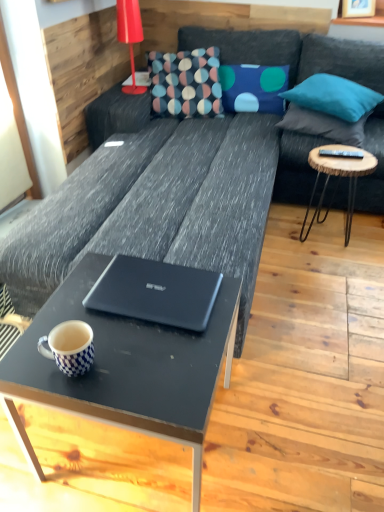
What are the coordinates of `blue fabric pillow at upper right, the first pillow positioned from the left` in the screenshot? It's located at (253, 88).

Describe the element at coordinates (156, 292) in the screenshot. I see `matte black laptop at center` at that location.

This screenshot has width=384, height=512. I want to click on matte red lamp at upper left, so click(x=130, y=36).

This screenshot has height=512, width=384. What are the coordinates of `black plastic remote at right` in the screenshot? It's located at (341, 153).

Image resolution: width=384 pixels, height=512 pixels. Describe the element at coordinates (164, 200) in the screenshot. I see `dark gray fabric couch at center` at that location.

You are a GUI agent. You are given a task and a screenshot of the screen. Output one action in this format:
    pyautogui.click(x=<x>, y=<y>)
    Task: Click on the blue fabric pillow at upper right, the first pillow positioned from the left
    Image resolution: width=384 pixels, height=512 pixels.
    Given the screenshot: What is the action you would take?
    pyautogui.click(x=253, y=88)

How different are the orientations of wooden picture frame at upper right and white checkered mug at lower left in degrees?

The angular difference between wooden picture frame at upper right and white checkered mug at lower left is 71.1 degrees.

Between wooden picture frame at upper right and white checkered mug at lower left, which one is positioned in front?

white checkered mug at lower left is more forward.

Would you say wooden picture frame at upper right is a long distance from white checkered mug at lower left?

Yes, wooden picture frame at upper right and white checkered mug at lower left are quite far apart.

Is point (350, 2) positioned before point (64, 357)?

No, (350, 2) is behind (64, 357).

Is blue fabric pillow at upper right, the first pillow positioned from the left, smaller than dark gray fabric couch at center?

Correct, blue fabric pillow at upper right, the first pillow positioned from the left, occupies less space than dark gray fabric couch at center.

Are blue fabric pillow at upper right, the first pillow positioned from the left, and dark gray fabric couch at center located far from each other?

Actually, blue fabric pillow at upper right, the first pillow positioned from the left, and dark gray fabric couch at center are a little close together.

Based on the photo, what's the angular difference between blue fabric pillow at upper right, which is counted as the third pillow, starting from the right, and dark gray fabric couch at center's facing directions?

The angle between the facing direction of blue fabric pillow at upper right, which is counted as the third pillow, starting from the right, and the facing direction of dark gray fabric couch at center is 6.4 degrees.

Locate an element on the screen. Image resolution: width=384 pixels, height=512 pixels. studio couch that is in front of the blue fabric pillow at upper right, the first pillow positioned from the left is located at coordinates (164, 200).

Can you see teal fabric pillow at upper right, which appears as the first pillow when viewed from the right, touching teal fabric pillow at upper right, which appears as the second pillow when viewed from the left?

Yes.

Locate an element on the screen. the 2nd pillow directly beneath the teal fabric pillow at upper right, which appears as the second pillow when viewed from the left (from a real-world perspective) is located at coordinates (323, 125).

From a real-world perspective, is teal fabric pillow at upper right, positioned as the 3th pillow in left-to-right order, located higher than teal fabric pillow at upper right, which appears as the second pillow when viewed from the left?

No.

Is teal fabric pillow at upper right, positioned as the 3th pillow in left-to-right order, to the right of teal fabric pillow at upper right, which appears as the second pillow when viewed from the left, from the viewer's perspective?

Yes, teal fabric pillow at upper right, positioned as the 3th pillow in left-to-right order, is to the right of teal fabric pillow at upper right, which appears as the second pillow when viewed from the left.

How far apart are teal fabric pillow at upper right, which appears as the second pillow when viewed from the left, and black plastic remote at right?

teal fabric pillow at upper right, which appears as the second pillow when viewed from the left, and black plastic remote at right are 38.95 centimeters apart from each other.

Does teal fabric pillow at upper right, the second pillow viewed from the right, turn towards black plastic remote at right?

No.

Is teal fabric pillow at upper right, the second pillow viewed from the right, far from black plastic remote at right?

That's not correct — teal fabric pillow at upper right, the second pillow viewed from the right, is a little close to black plastic remote at right.

Who is shorter, teal fabric pillow at upper right, positioned as the 3th pillow in left-to-right order, or dark gray fabric couch at center?

teal fabric pillow at upper right, positioned as the 3th pillow in left-to-right order, is shorter.

Considering the positions of objects teal fabric pillow at upper right, positioned as the 3th pillow in left-to-right order, and dark gray fabric couch at center in the image provided, who is more to the left, teal fabric pillow at upper right, positioned as the 3th pillow in left-to-right order, or dark gray fabric couch at center?

dark gray fabric couch at center.

From the image's perspective, would you say teal fabric pillow at upper right, positioned as the 3th pillow in left-to-right order, is positioned over dark gray fabric couch at center?

Yes, from the image's perspective, teal fabric pillow at upper right, positioned as the 3th pillow in left-to-right order, is on top of dark gray fabric couch at center.

What's the angular difference between teal fabric pillow at upper right, positioned as the 3th pillow in left-to-right order, and dark gray fabric couch at center's facing directions?

There is a 81.6-degree angle between the facing directions of teal fabric pillow at upper right, positioned as the 3th pillow in left-to-right order, and dark gray fabric couch at center.

Which object is positioned more to the right, black plastic remote at right or dark gray fabric couch at center?

black plastic remote at right.

Can you see black plastic remote at right touching dark gray fabric couch at center?

black plastic remote at right and dark gray fabric couch at center are not in contact.

I want to click on remote on the right side of dark gray fabric couch at center, so click(341, 153).

Who is shorter, matte red lamp at upper left or matte black laptop at center?

With less height is matte black laptop at center.

Consider the image. Considering the positions of objects matte red lamp at upper left and matte black laptop at center in the image provided, who is more to the right, matte red lamp at upper left or matte black laptop at center?

Positioned to the right is matte black laptop at center.

Is matte red lamp at upper left in front of or behind matte black laptop at center in the image?

Visually, matte red lamp at upper left is located behind matte black laptop at center.

Is matte red lamp at upper left looking in the opposite direction of matte black laptop at center?

No, matte black laptop at center is not at the back of matte red lamp at upper left.

Find the location of `picture frame above the white checkered mug at lower left (from a real-world perspective)`. picture frame above the white checkered mug at lower left (from a real-world perspective) is located at coordinates (358, 8).

Identify the location of studio couch lying below the blue fabric pillow at upper right, the first pillow positioned from the left (from the image's perspective). (164, 200).

Which object lies nearer to the anchor point teal fabric pillow at upper right, positioned as the 3th pillow in left-to-right order, matte black coffee table at center or black plastic remote at right?

→ Among the two, black plastic remote at right is located nearer to teal fabric pillow at upper right, positioned as the 3th pillow in left-to-right order.

From the picture: Which object lies nearer to the anchor point blue fabric pillow at upper right, which is counted as the third pillow, starting from the right, wooden round side table at right or dark gray fabric couch at center?

The object closer to blue fabric pillow at upper right, which is counted as the third pillow, starting from the right, is dark gray fabric couch at center.

Estimate the real-world distances between objects in this image. Which object is further from teal fabric pillow at upper right, positioned as the 3th pillow in left-to-right order, black plastic remote at right or matte red lamp at upper left?

Among the two, matte red lamp at upper left is located further to teal fabric pillow at upper right, positioned as the 3th pillow in left-to-right order.

When comparing their distances from black plastic remote at right, does matte black coffee table at center or teal fabric pillow at upper right, which appears as the second pillow when viewed from the left, seem further?

The object further to black plastic remote at right is matte black coffee table at center.

Looking at the image, which one is located closer to dark gray fabric couch at center, multicolored fabric pillow at center or wooden picture frame at upper right?

multicolored fabric pillow at center.

Which object lies further to the anchor point dark gray fabric couch at center, wooden round side table at right or matte red lamp at upper left?

matte red lamp at upper left lies further to dark gray fabric couch at center than the other object.

Based on the photo, from the image, which object appears to be nearer to multicolored fabric pillow at center, matte black coffee table at center or matte black laptop at center?

matte black laptop at center lies closer to multicolored fabric pillow at center than the other object.

Considering their positions, is white checkered mug at lower left positioned further to teal fabric pillow at upper right, positioned as the 3th pillow in left-to-right order, than black plastic remote at right?

white checkered mug at lower left is further to teal fabric pillow at upper right, positioned as the 3th pillow in left-to-right order.

Image resolution: width=384 pixels, height=512 pixels. Identify the location of throw pillow between wooden picture frame at upper right and black plastic remote at right in the vertical direction. (185, 83).

At what (x,y) coordinates should I click in order to perform the action: click on studio couch situated between white checkered mug at lower left and wooden round side table at right from left to right. Please return your answer as a coordinate pair (x, y). Looking at the image, I should click on (164, 200).

I want to click on laptop between white checkered mug at lower left and blue fabric pillow at upper right, which is counted as the third pillow, starting from the right, from front to back, so click(156, 292).

Where is `remote between teal fabric pillow at upper right, which appears as the first pillow when viewed from the right, and wooden round side table at right from top to bottom`? remote between teal fabric pillow at upper right, which appears as the first pillow when viewed from the right, and wooden round side table at right from top to bottom is located at coordinates (341, 153).